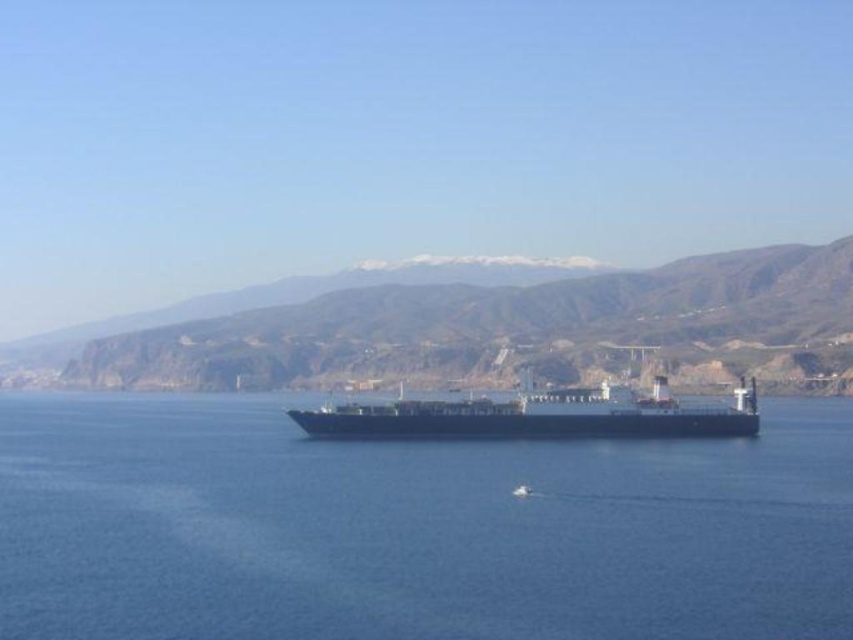
Question: Among these points, which one is farthest from the camera?

Choices:
 (A) (402, 406)
 (B) (387, 371)

Answer: (B)

Question: Does blue water at center have a smaller size compared to brown rocky mountain at center?

Choices:
 (A) no
 (B) yes

Answer: (B)

Question: Observing the image, what is the correct spatial positioning of brown rocky mountain at center in reference to black matte cargo ship at center?

Choices:
 (A) right
 (B) left

Answer: (B)

Question: Which of these objects is positioned closest to the brown rocky mountain at center?

Choices:
 (A) blue water at center
 (B) black matte cargo ship at center

Answer: (B)

Question: Which object is positioned farthest from the black matte cargo ship at center?

Choices:
 (A) blue water at center
 (B) brown rocky mountain at center

Answer: (B)

Question: Can you confirm if blue water at center is thinner than black matte cargo ship at center?

Choices:
 (A) no
 (B) yes

Answer: (A)